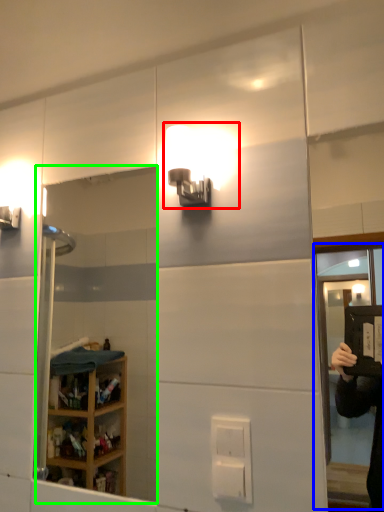
Question: Which object is the closest to the light fixture (highlighted by a red box)? Choose among these: screen door (highlighted by a blue box) or mirror (highlighted by a green box).

Choices:
 (A) screen door
 (B) mirror

Answer: (B)